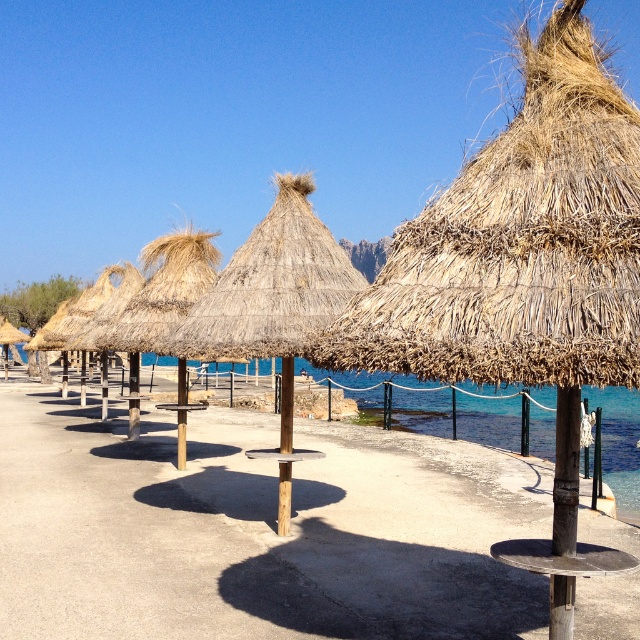
Consider the image. Which is more to the left, brown wooden path at center or natural straw umbrella at center?

From the viewer's perspective, brown wooden path at center appears more on the left side.

Does brown wooden path at center come in front of natural straw umbrella at center?

No, brown wooden path at center is further to the viewer.

Is point (186, 477) positioned behind point (225, 324)?

Yes, it is behind point (225, 324).

What are the coordinates of `brown wooden path at center` in the screenshot? It's located at [x=256, y=529].

Who is more distant from viewer, (307, 308) or (570, 429)?

The point (307, 308) is more distant.

Is the position of natural straw umbrella at center more distant than that of brown wood pole at center?

Yes.

Is point (296, 268) closer to camera compared to point (550, 579)?

No, it is not.

Where is `natural straw umbrella at center`? natural straw umbrella at center is located at coordinates (275, 291).

Does brown wooden path at center have a lesser width compared to brown wood pole at center?

Incorrect, brown wooden path at center's width is not less than brown wood pole at center's.

This screenshot has height=640, width=640. I want to click on brown wooden path at center, so click(256, 529).

I want to click on brown wooden path at center, so click(256, 529).